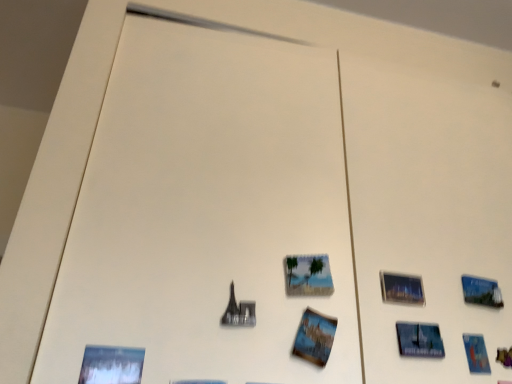
Question: Would you say printed paper postcard at center, which is the second postcard from back to front, contains blue glossy postcard at lower right, which ranks as the second postcard in front-to-back order?

Choices:
 (A) yes
 (B) no

Answer: (B)

Question: Does printed paper postcard at center, which is the second postcard from back to front, appear on the right side of blue glossy postcard at lower right, the 1th postcard positioned from the back?

Choices:
 (A) yes
 (B) no

Answer: (B)

Question: Can you confirm if printed paper postcard at center, which is the second postcard from back to front, is smaller than blue glossy postcard at lower right, the 1th postcard positioned from the back?

Choices:
 (A) no
 (B) yes

Answer: (A)

Question: Is printed paper postcard at center, the 1th postcard from the front, further to camera compared to blue glossy postcard at lower right, placed as the 2th postcard when sorted from left to right?

Choices:
 (A) no
 (B) yes

Answer: (A)

Question: From the image's perspective, is printed paper postcard at center, the 1th postcard from the front, above blue glossy postcard at lower right, the 1th postcard positioned from the back?

Choices:
 (A) yes
 (B) no

Answer: (A)

Question: Is metallic glass picture frame at upper right, marked as the 2th picture frame in a left-to-right arrangement, to the left or to the right of matte plastic picture frame at center, the 2th picture frame in the right-to-left sequence, in the image?

Choices:
 (A) right
 (B) left

Answer: (A)

Question: Looking at their shapes, would you say metallic glass picture frame at upper right, arranged as the first picture frame when viewed from the right, is wider or thinner than matte plastic picture frame at center, the 2th picture frame in the right-to-left sequence?

Choices:
 (A) wide
 (B) thin

Answer: (A)

Question: Is metallic glass picture frame at upper right, arranged as the first picture frame when viewed from the right, taller or shorter than matte plastic picture frame at center, which is the first picture frame from left to right?

Choices:
 (A) tall
 (B) short

Answer: (B)

Question: Considering their positions, is metallic glass picture frame at upper right, arranged as the first picture frame when viewed from the right, located in front of or behind matte plastic picture frame at center, the 2th picture frame in the right-to-left sequence?

Choices:
 (A) front
 (B) behind

Answer: (B)

Question: From a real-world perspective, is matte plastic picture frame at center, the 2th picture frame in the right-to-left sequence, above or below metallic glass picture frame at upper right, arranged as the first picture frame when viewed from the right?

Choices:
 (A) below
 (B) above

Answer: (B)

Question: Considering the relative positions of matte plastic picture frame at center, which is the first picture frame from left to right, and metallic glass picture frame at upper right, marked as the 2th picture frame in a left-to-right arrangement, in the image provided, is matte plastic picture frame at center, which is the first picture frame from left to right, to the left or to the right of metallic glass picture frame at upper right, marked as the 2th picture frame in a left-to-right arrangement,?

Choices:
 (A) right
 (B) left

Answer: (B)

Question: Considering the positions of matte plastic picture frame at center, the 2th picture frame in the right-to-left sequence, and metallic glass picture frame at upper right, arranged as the first picture frame when viewed from the right, in the image, is matte plastic picture frame at center, the 2th picture frame in the right-to-left sequence, bigger or smaller than metallic glass picture frame at upper right, arranged as the first picture frame when viewed from the right,?

Choices:
 (A) small
 (B) big

Answer: (A)

Question: Is point (305, 269) closer or farther from the camera than point (403, 297)?

Choices:
 (A) closer
 (B) farther

Answer: (A)

Question: From a real-world perspective, is matte plastic picture frame at center, the 2th picture frame in the right-to-left sequence, positioned above or below blue glossy postcard at lower right, which ranks as the second postcard in front-to-back order?

Choices:
 (A) below
 (B) above

Answer: (B)

Question: Looking at the image, does matte plastic picture frame at center, which is the first picture frame from left to right, seem bigger or smaller compared to blue glossy postcard at lower right, placed as the 2th postcard when sorted from left to right?

Choices:
 (A) big
 (B) small

Answer: (A)